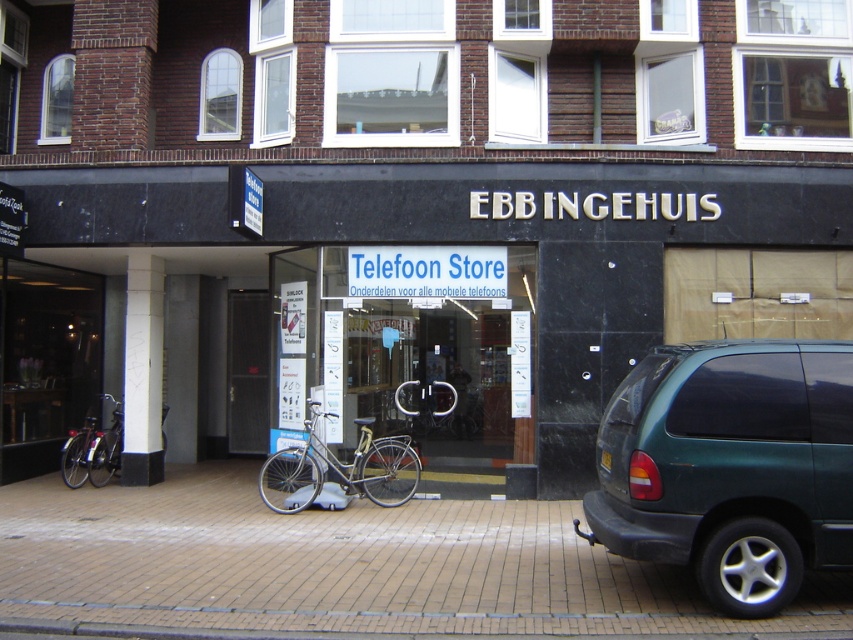
You are a delivery person trying to enter the EBB INGEHUIS store. You see the black glass storefront at center and the silver metallic bicycle at center. Which object is taller?

The black glass storefront at center is taller than the silver metallic bicycle at center.

You are standing at the entrance of the store and looking out. You see a point marked at coordinates (730, 467). What object is located at that point?

The point at coordinates (730, 467) marks the green matte SUV at the right.